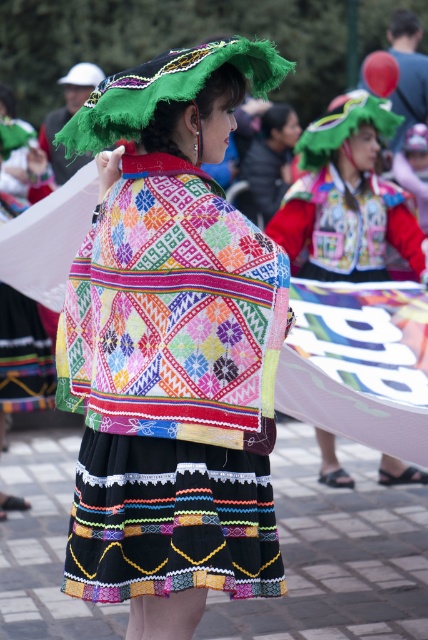
Question: Does green fuzzy headdress at upper center come behind embroidered fabric blouse at center?

Choices:
 (A) yes
 (B) no

Answer: (B)

Question: Considering the relative positions of embroidered fabric jacket at center and green fuzzy headdress at upper center in the image provided, where is embroidered fabric jacket at center located with respect to green fuzzy headdress at upper center?

Choices:
 (A) left
 (B) right

Answer: (B)

Question: Estimate the real-world distances between objects in this image. Which object is farther from the embroidered fabric jacket at center?

Choices:
 (A) embroidered fabric blouse at center
 (B) embroidered fabric shawl at center

Answer: (B)

Question: Considering the relative positions of embroidered fabric shawl at center and embroidered fabric jacket at center in the image provided, where is embroidered fabric shawl at center located with respect to embroidered fabric jacket at center?

Choices:
 (A) right
 (B) left

Answer: (B)

Question: Which of the following is the farthest from the observer?

Choices:
 (A) (279, 58)
 (B) (407, 250)
 (C) (107, 452)

Answer: (B)

Question: Estimate the real-world distances between objects in this image. Which object is farther from the embroidered fabric jacket at center?

Choices:
 (A) embroidered fabric shawl at center
 (B) green fuzzy headdress at upper center

Answer: (A)